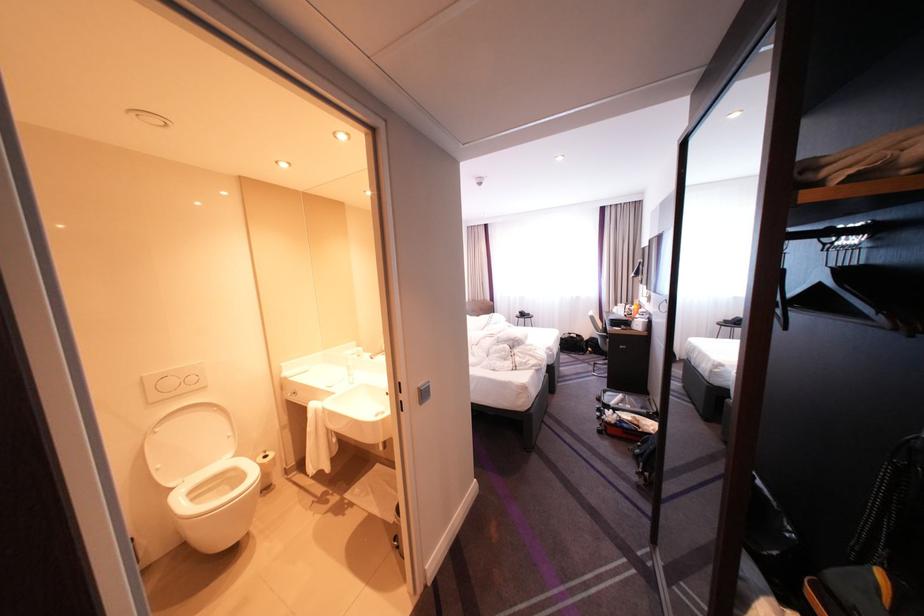
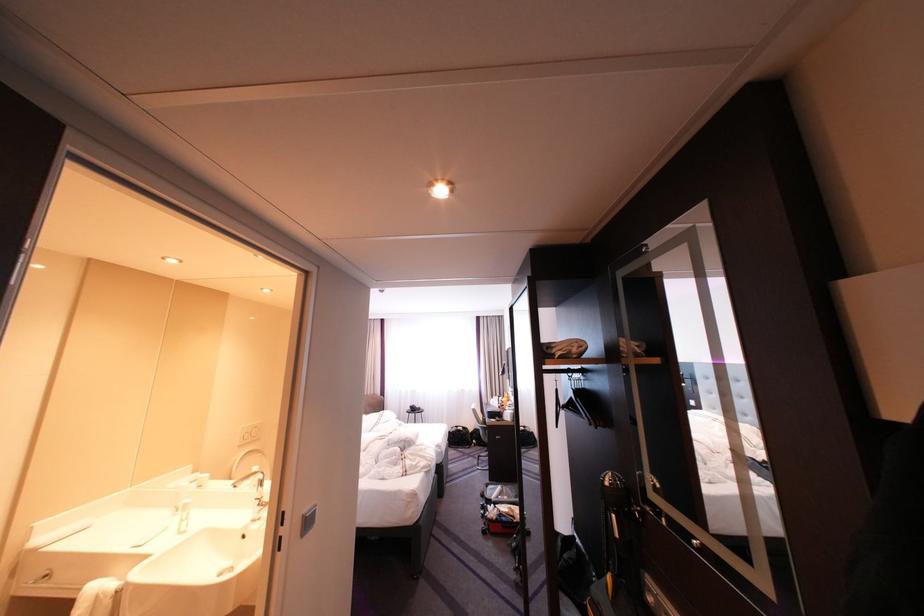
Find the pixel in the second image that matches [578,338] in the first image.

(467, 431)